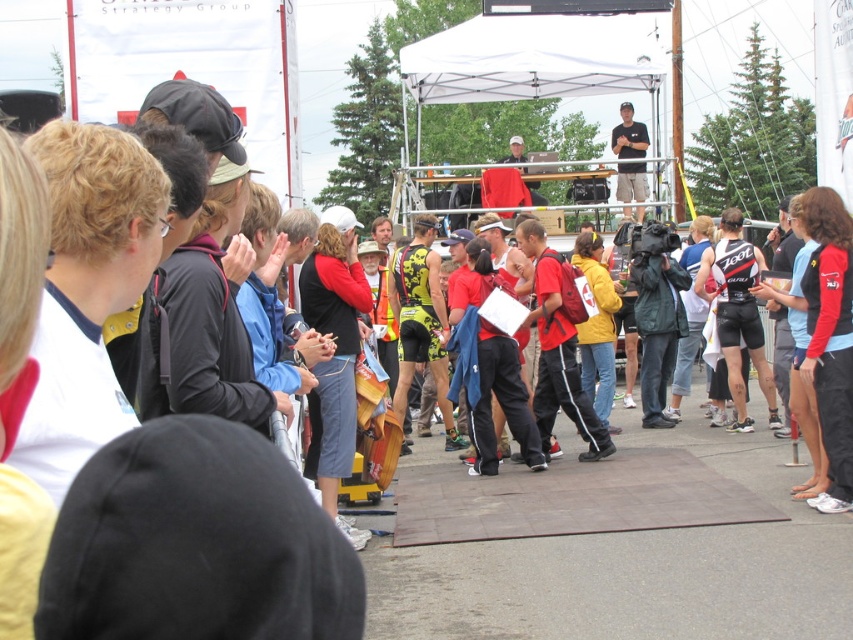
You are a photographer at the event and want to capture the white fabric canopy at upper center. What are the coordinates where you should focus your camera?

The white fabric canopy at upper center is located at coordinates point [532,58].

You are a photographer at the event and want to capture both the white fabric canopy at upper center and the black matte shirt at upper center in a single photo. Which object should you focus on first to ensure both are in frame?

The white fabric canopy at upper center occupies less space than the black matte shirt at upper center, so you should focus on the black matte shirt at upper center first to ensure both fit in the frame.

You are a photographer standing at the back of the event. You want to capture a photo of both the white fabric canopy at upper center and the black matte shirt at upper center in the same frame. Given that your camera has a maximum focus range of 10 feet, will both subjects be within the focus range?

The distance between the white fabric canopy at upper center and the black matte shirt at upper center is 8.68 feet, which is within the camera maximum focus range of 10 feet. Therefore, both subjects will be in focus.